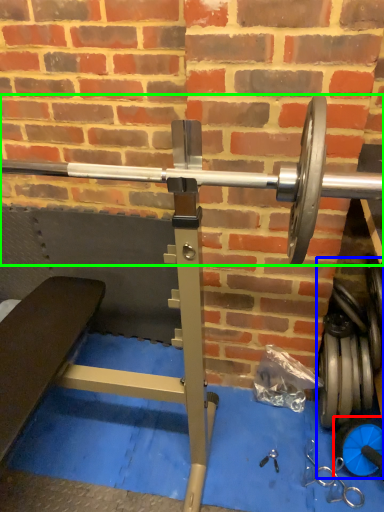
Question: Which object is the closest to the dumbbell (highlighted by a red box)? Choose among these: dumbbell (highlighted by a blue box) or barbell (highlighted by a green box).

Choices:
 (A) dumbbell
 (B) barbell

Answer: (A)